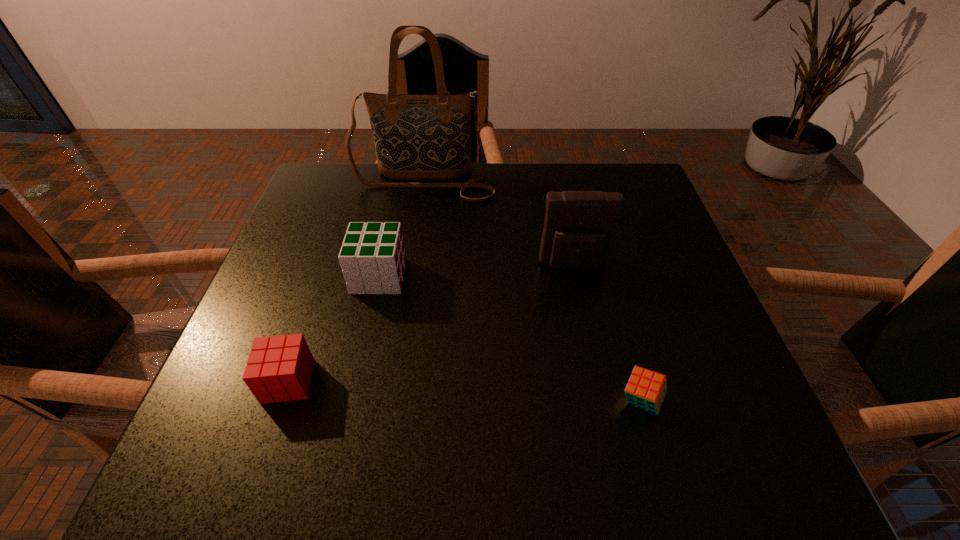
Find the location of a particular element. The image size is (960, 540). handbag is located at coordinates (417, 136).

The height and width of the screenshot is (540, 960). I want to click on the tallest object, so click(x=417, y=136).

Find the location of a particular element. Image resolution: width=960 pixels, height=540 pixels. pouch is located at coordinates (579, 227).

This screenshot has width=960, height=540. Identify the location of the third shortest object. (372, 256).

You are a GUI agent. You are given a task and a screenshot of the screen. Output one action in this format:
    pyautogui.click(x=<x>, y=<y>)
    Task: Click on the farthest cube
    The image size is (960, 540).
    Given the screenshot: What is the action you would take?
    pyautogui.click(x=372, y=256)

Identify the location of the leftmost cube. Image resolution: width=960 pixels, height=540 pixels. (279, 368).

Locate an element on the screen. This screenshot has height=540, width=960. the rightmost cube is located at coordinates (646, 389).

You are a GUI agent. You are given a task and a screenshot of the screen. Output one action in this format:
    pyautogui.click(x=<x>, y=<y>)
    Task: Click on the free region located on the front-facing side of the tallest object
    This screenshot has width=960, height=540.
    Given the screenshot: What is the action you would take?
    pyautogui.click(x=412, y=253)

Where is `free space located with an open flap on the fourth shortest object`? free space located with an open flap on the fourth shortest object is located at coordinates (589, 343).

Image resolution: width=960 pixels, height=540 pixels. What are the coordinates of `vacant space located 0.310m on the red face of the tallest cube` in the screenshot? It's located at (547, 276).